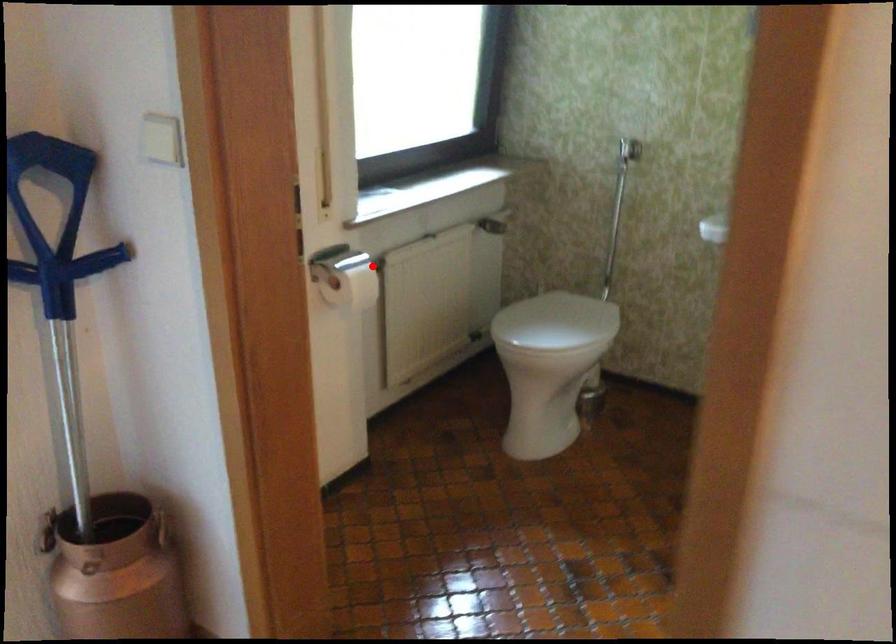
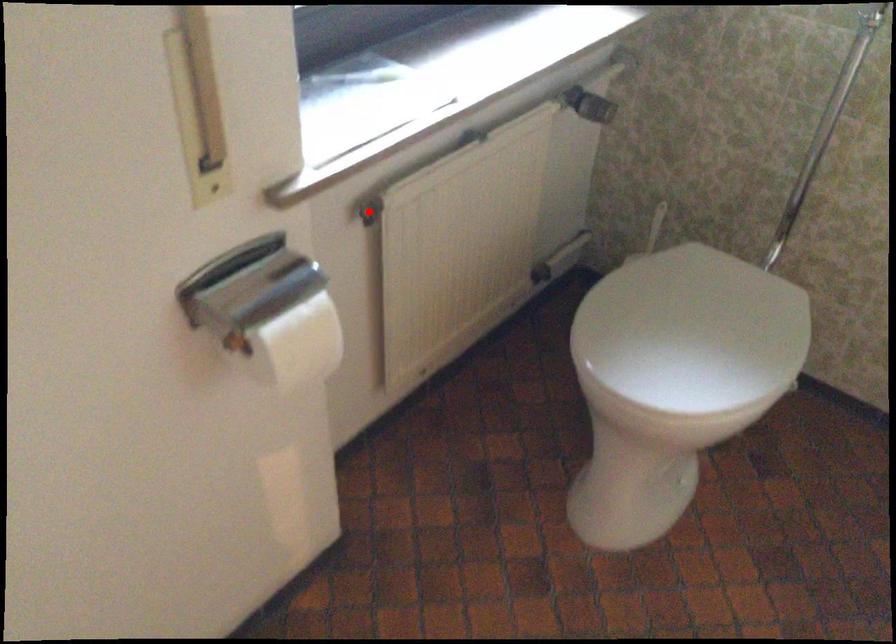
I am providing you with two images of the same scene from different viewpoints. A red point is marked on the first image and another point is marked on the second image. Are the points marked in image1 and image2 representing the same 3D position?

Yes